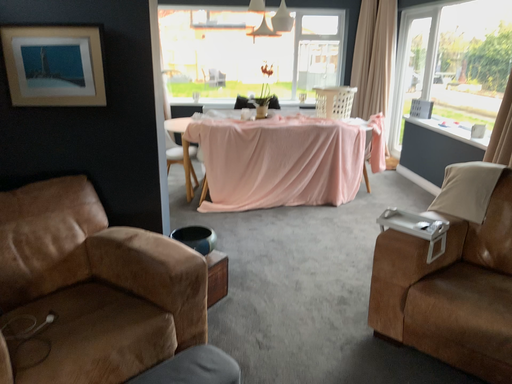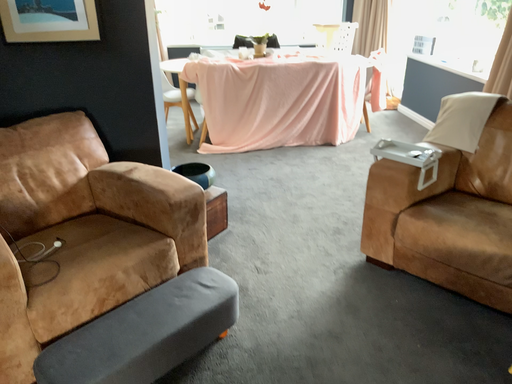
Question: Which way did the camera rotate in the video?

Choices:
 (A) rotated downward
 (B) rotated upward

Answer: (A)